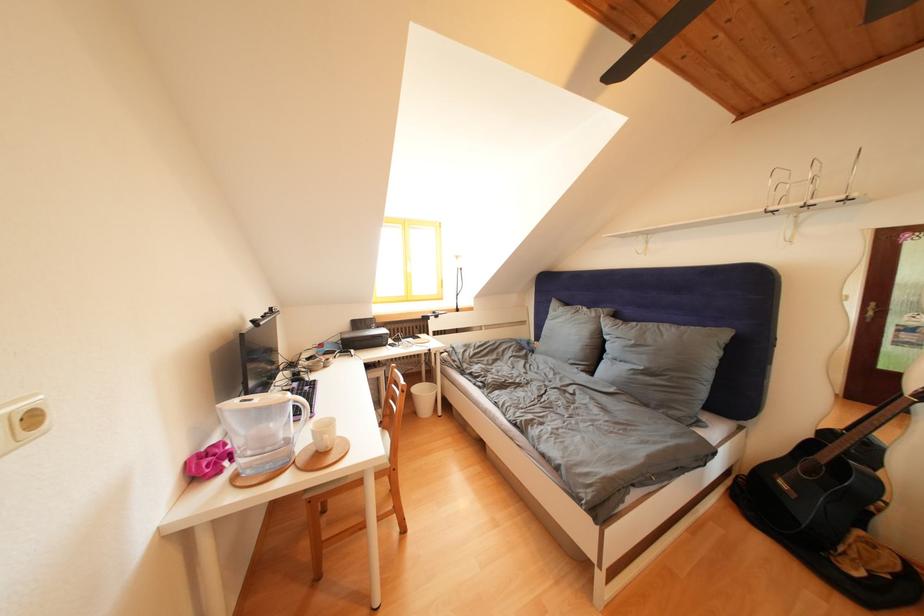
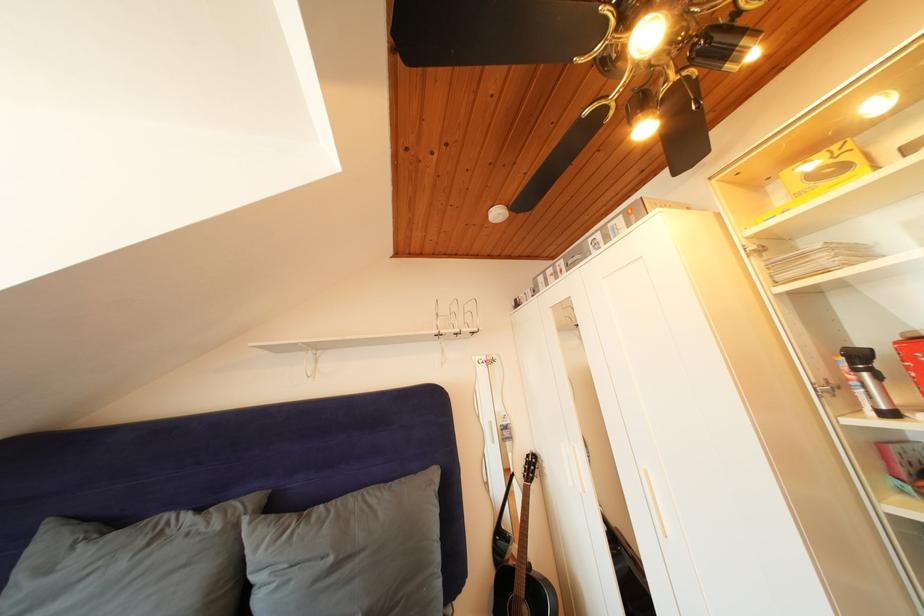
Locate, in the second image, the point that corresponds to pixel 640 347 in the first image.

(338, 565)